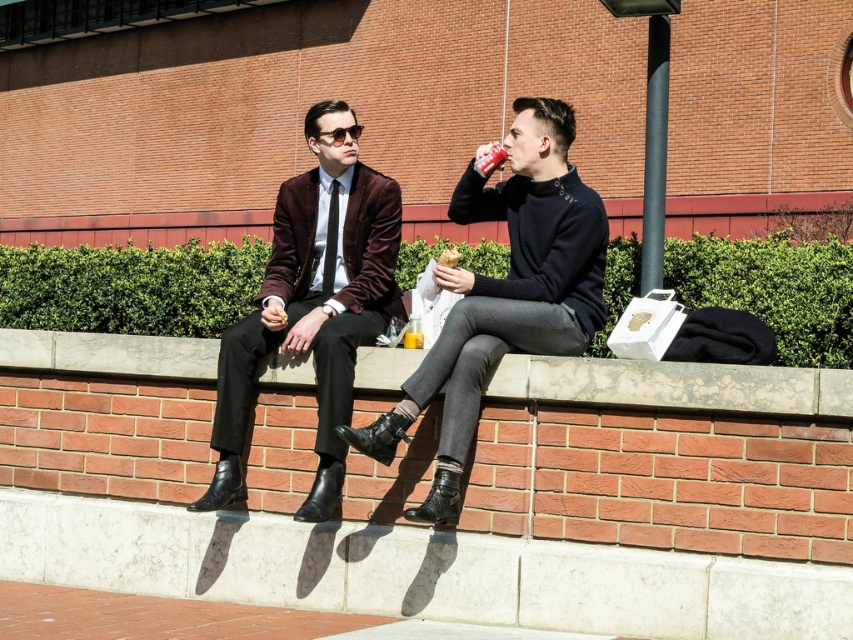
Question: Does matte black sweater at center have a larger size compared to smooth concrete ledge at center?

Choices:
 (A) yes
 (B) no

Answer: (A)

Question: Can you confirm if matte black sweater at center is smaller than velvet burgundy blazer at center?

Choices:
 (A) yes
 (B) no

Answer: (B)

Question: Which point is farther to the camera?

Choices:
 (A) (480, 150)
 (B) (770, 401)
 (C) (223, 499)

Answer: (A)

Question: Which point appears farthest from the camera in this image?

Choices:
 (A) (804, 408)
 (B) (556, 252)
 (C) (332, 328)

Answer: (C)

Question: Which object is the farthest from the velvet burgundy blazer at center?

Choices:
 (A) matte black sweater at center
 (B) smooth concrete ledge at center

Answer: (B)

Question: Where is velvet burgundy blazer at center located in relation to smooth concrete ledge at center in the image?

Choices:
 (A) above
 (B) below

Answer: (A)